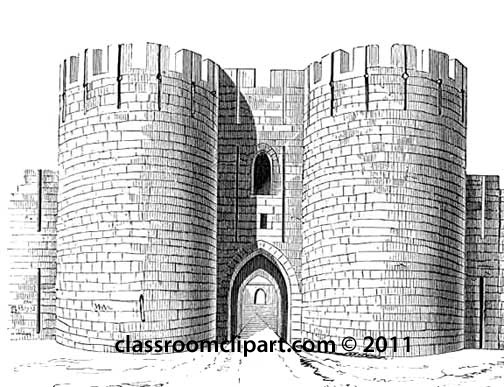
The width and height of the screenshot is (504, 387). In order to click on classroom in this screenshot , I will do `click(174, 349)`.